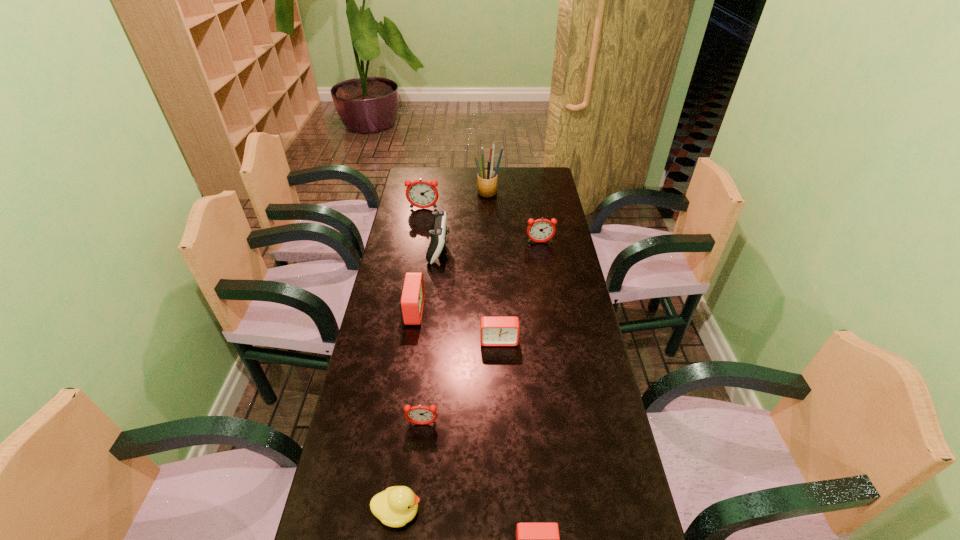
You are a GUI agent. You are given a task and a screenshot of the screen. Output one action in this format:
    pyautogui.click(x=<x>, y=<y>)
    Task: Click on the free space located on the front-facing side of the second farthest red alarm clock
    The width and height of the screenshot is (960, 540).
    Given the screenshot: What is the action you would take?
    pyautogui.click(x=501, y=388)

Find the location of a particular element. The width and height of the screenshot is (960, 540). blank space located 0.090m on the front-facing side of the nearest reddish-pink alarm clock is located at coordinates (419, 460).

Locate an element on the screen. This screenshot has height=540, width=960. object that is at the far edge is located at coordinates (486, 179).

Image resolution: width=960 pixels, height=540 pixels. I want to click on control that is at the left edge, so click(438, 230).

Locate an element on the screen. This screenshot has height=540, width=960. duckling that is at the left edge is located at coordinates (x=397, y=505).

I want to click on object located in the right edge section of the desktop, so (x=541, y=230).

In the image, there is a desktop. Where is `vacant space at the far edge`? vacant space at the far edge is located at coordinates (515, 181).

At what (x,y) coordinates should I click in order to perform the action: click on free space at the left edge of the desktop. Please return your answer as a coordinate pair (x, y). Looking at the image, I should click on (391, 314).

The height and width of the screenshot is (540, 960). What are the coordinates of `vacant space at the right edge` in the screenshot? It's located at (588, 444).

You are a GUI agent. You are given a task and a screenshot of the screen. Output one action in this format:
    pyautogui.click(x=<x>, y=<y>)
    Task: Click on the vacant space at the far left corner
    This screenshot has height=540, width=960.
    Given the screenshot: What is the action you would take?
    [419, 169]